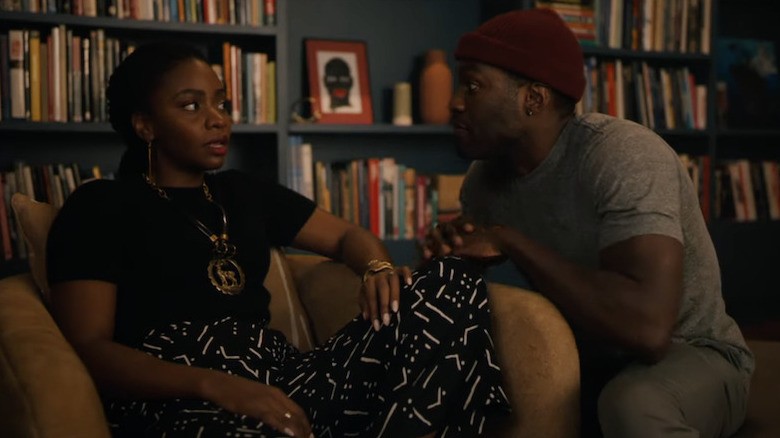
The height and width of the screenshot is (438, 780). I want to click on vase, so click(x=440, y=92).